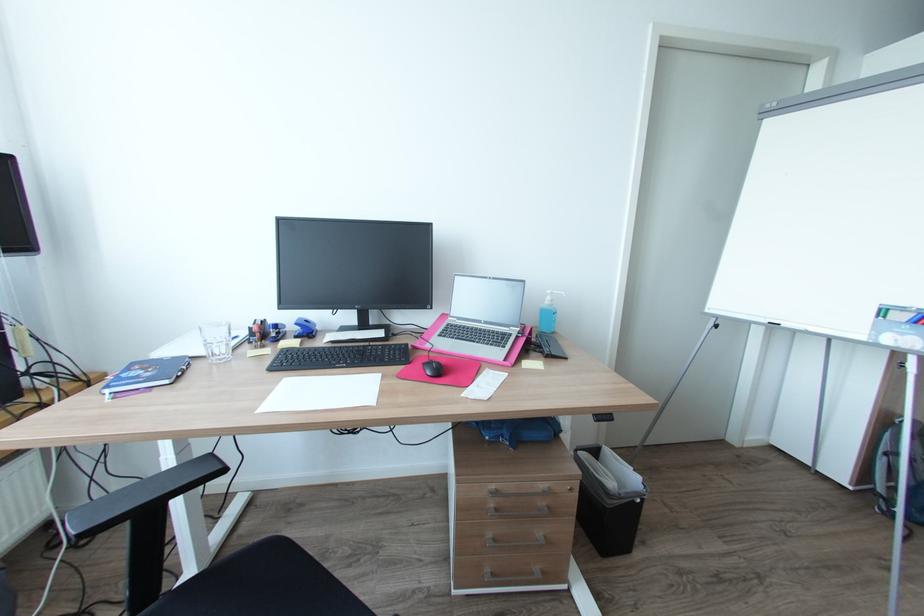
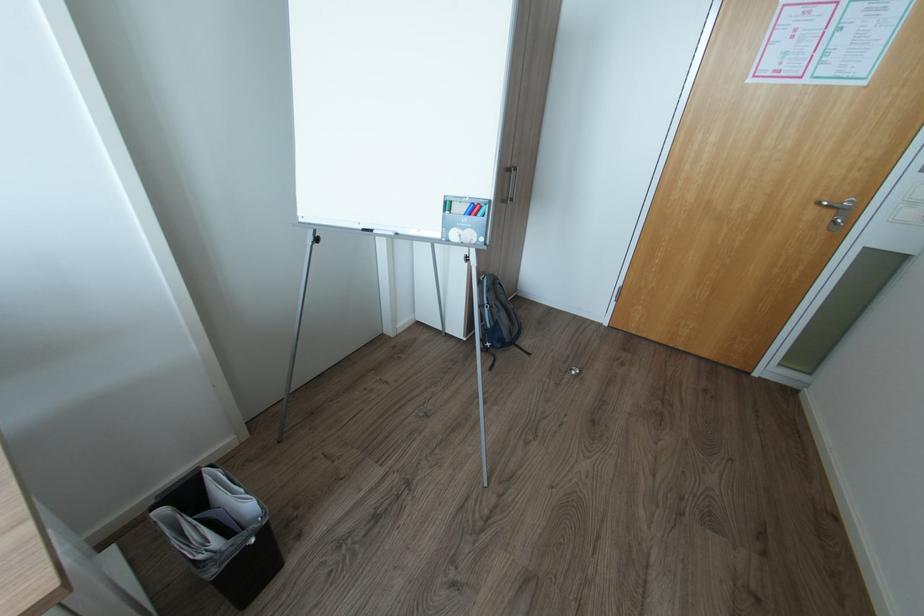
Where in the second image is the point corresponding to [786,325] from the first image?

(380, 231)